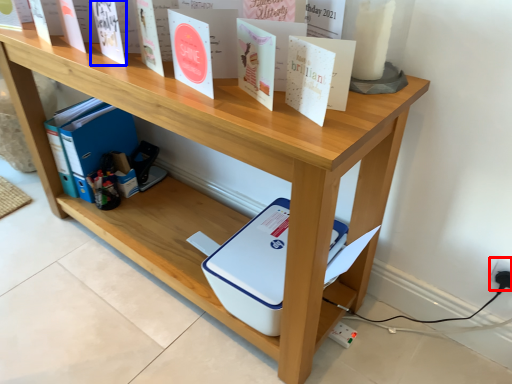
Question: Which object is further to the camera taking this photo, electric outlet (highlighted by a red box) or paperback book (highlighted by a blue box)?

Choices:
 (A) electric outlet
 (B) paperback book

Answer: (A)